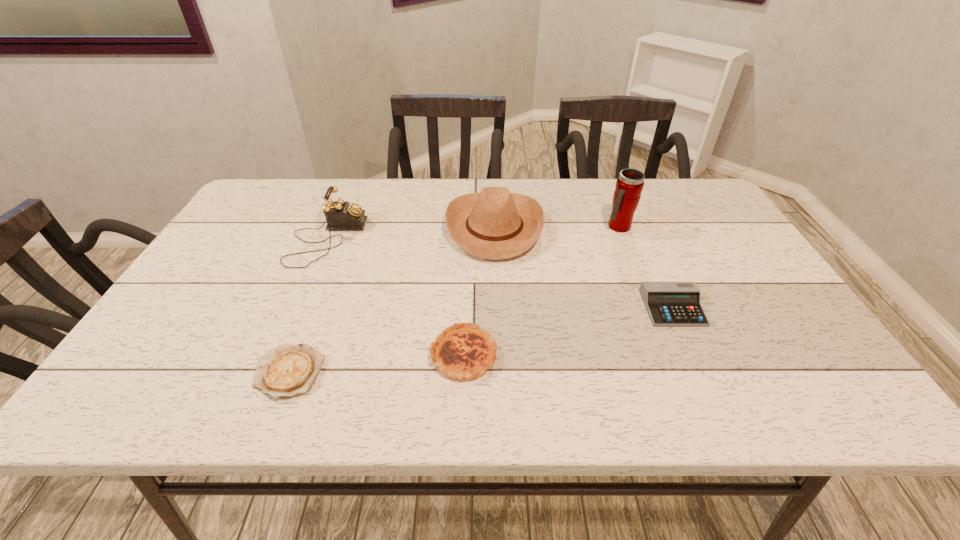
Where is `free space located 0.300m on the front-facing side of the cowboy hat`? free space located 0.300m on the front-facing side of the cowboy hat is located at coordinates (344, 227).

Find the location of `free location located on the dial of the telephone`. free location located on the dial of the telephone is located at coordinates (500, 239).

This screenshot has width=960, height=540. In order to click on vacant space located 0.140m on the right of the calculator in this screenshot , I will do `click(758, 308)`.

Identify the location of vacant space situated 0.090m on the right of the right quiche. (539, 355).

Identify the location of vacant position located on the back of the shortest object. (329, 266).

Locate an element on the screen. This screenshot has height=540, width=960. thermos bottle at the far edge is located at coordinates (629, 185).

At what (x,y) coordinates should I click in order to perform the action: click on cowboy hat positioned at the far edge. Please return your answer as a coordinate pair (x, y). Looking at the image, I should click on (495, 224).

Locate an element on the screen. This screenshot has height=540, width=960. telephone that is positioned at the far edge is located at coordinates [340, 215].

Where is `blank space at the far edge`? blank space at the far edge is located at coordinates (604, 202).

Where is `free space at the near edge of the desktop`? The width and height of the screenshot is (960, 540). free space at the near edge of the desktop is located at coordinates (471, 393).